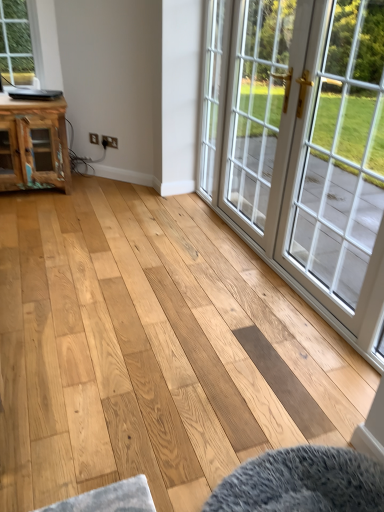
What do you see at coordinates (213, 94) in the screenshot? I see `clear glass door at center` at bounding box center [213, 94].

What is the approximate width of clear glass door at center?

The width of clear glass door at center is 3.02 inches.

You are a GUI agent. You are given a task and a screenshot of the screen. Output one action in this format:
    pyautogui.click(x=<x>, y=<y>)
    Task: Click on the clear glass door at center
    The width and height of the screenshot is (384, 512).
    Given the screenshot: What is the action you would take?
    pyautogui.click(x=213, y=94)

Where is `clear glass door at center`? This screenshot has height=512, width=384. clear glass door at center is located at coordinates (213, 94).